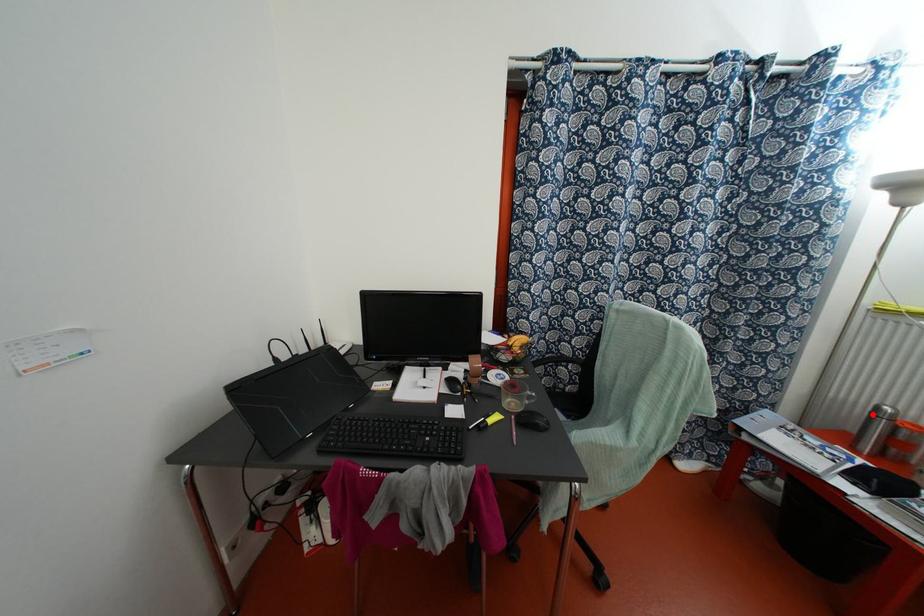
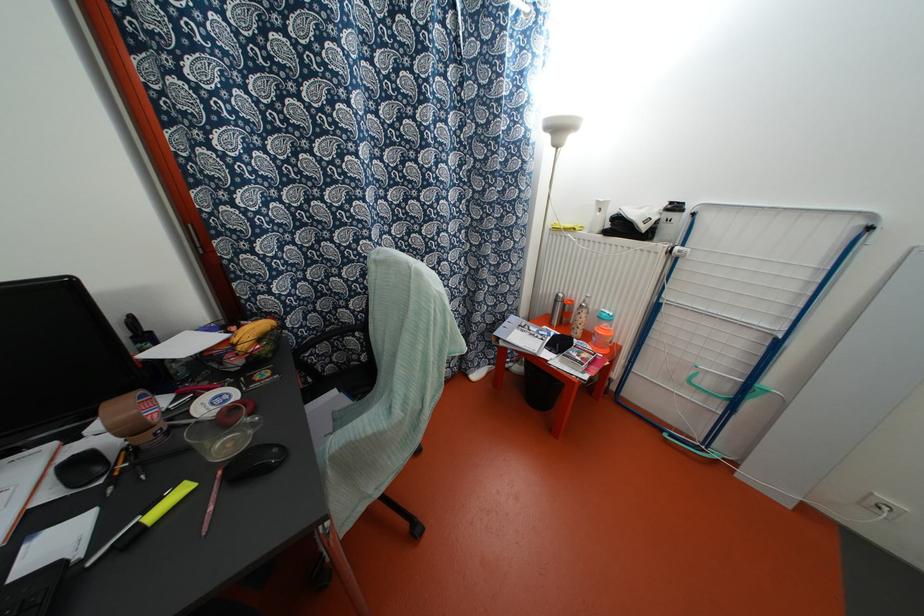
Locate, in the second image, the point that corresponds to the highlighted location in the first image.

(554, 301)